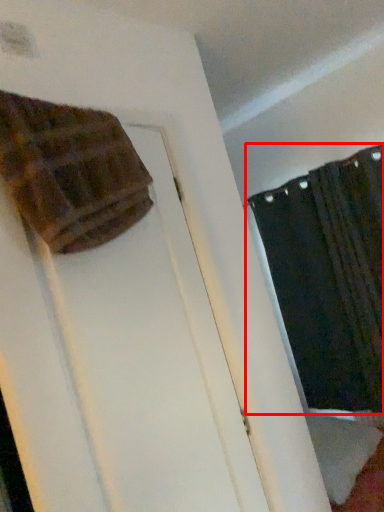
Question: From the image, what is the correct spatial relationship of curtain (annotated by the red box) in relation to blanket?

Choices:
 (A) left
 (B) right

Answer: (B)